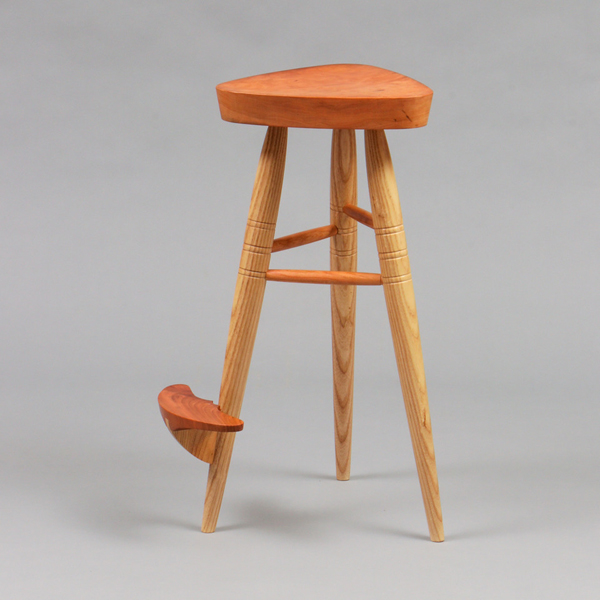
You are a GUI agent. You are given a task and a screenshot of the screen. Output one action in this format:
    pyautogui.click(x=<x>, y=<y>)
    Task: Click on the wood legs left
    The width and height of the screenshot is (600, 600).
    Given the screenshot: What is the action you would take?
    pyautogui.click(x=261, y=185)